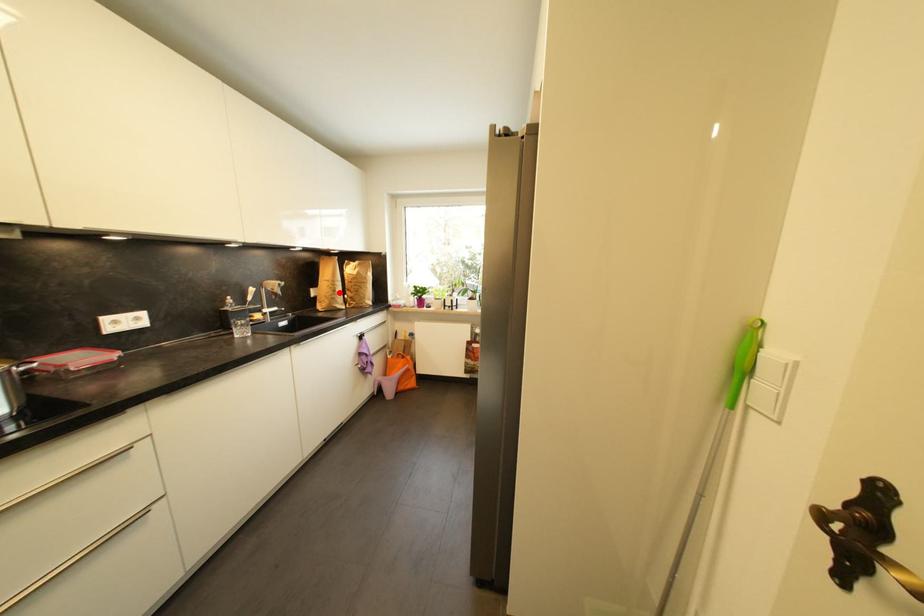
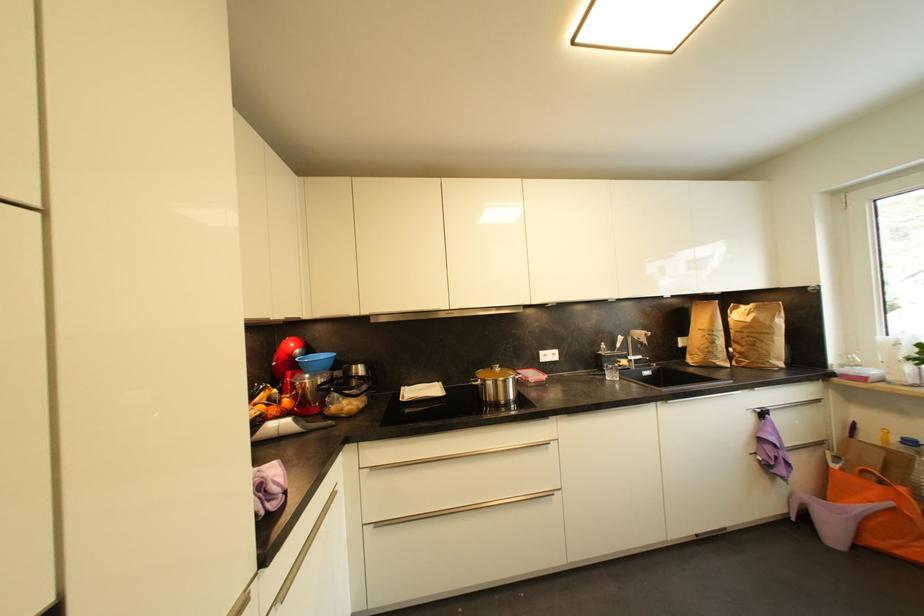
Question: A red point is marked in image1. In image2, is the corresponding 3D point closer to the camera or farther? Reply with the corresponding letter.

Choices:
 (A) The corresponding 3D point is closer.
 (B) The corresponding 3D point is farther.

Answer: (B)